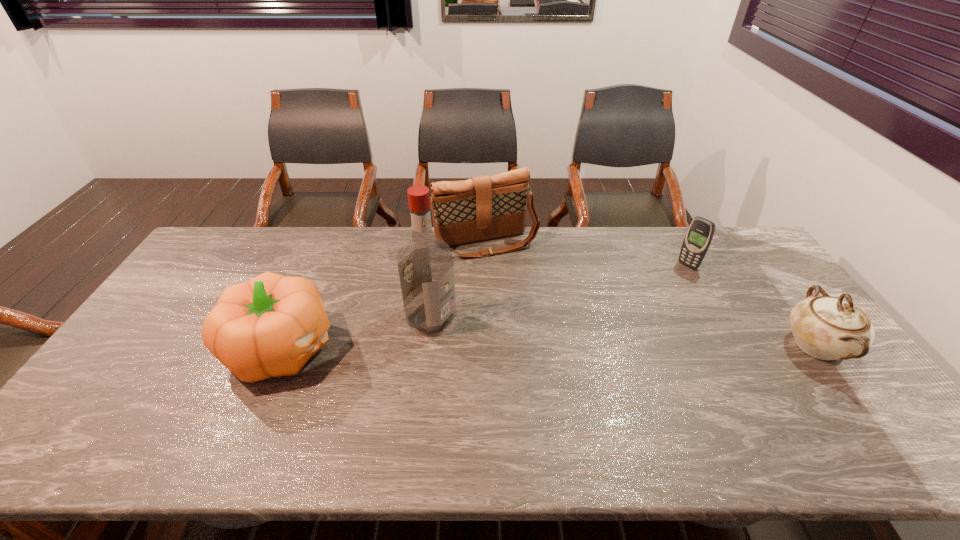
The image size is (960, 540). What are the coordinates of `vacant area at the far edge of the desktop` in the screenshot? It's located at (350, 247).

Locate an element on the screen. free space at the near edge of the desktop is located at coordinates (223, 396).

This screenshot has width=960, height=540. Identify the location of vacant space at the left edge. (192, 293).

Where is `vacant space at the far right corner`? vacant space at the far right corner is located at coordinates (732, 230).

Find the location of `vacant space at the near right corner of the desktop`. vacant space at the near right corner of the desktop is located at coordinates (850, 413).

At what (x,y) coordinates should I click in order to perform the action: click on vacant point located between the rightmost object and the cellular telephone. Please return your answer as a coordinate pair (x, y). Looking at the image, I should click on (752, 306).

Locate an element on the screen. free point between the liquor and the rightmost object is located at coordinates (623, 332).

This screenshot has height=540, width=960. In order to click on unoccupied position between the shoulder bag and the leftmost object in this screenshot , I will do [x=384, y=295].

At what (x,y) coordinates should I click in order to perform the action: click on empty space that is in between the liquor and the rightmost object. Please return your answer as a coordinate pair (x, y). Looking at the image, I should click on (623, 332).

Locate an element on the screen. The image size is (960, 540). vacant space in between the shoulder bag and the tallest object is located at coordinates (459, 280).